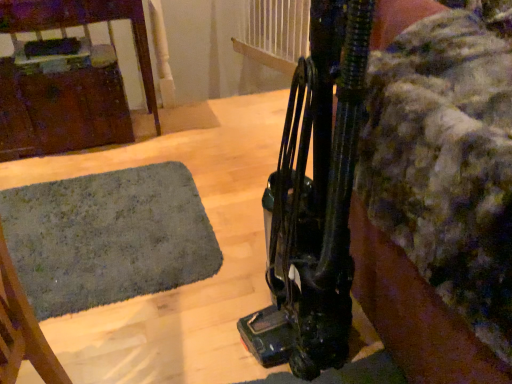
Measure the distance between point [268,275] and camera.

The depth of point [268,275] is 3.92 feet.

Locate an element on the screen. dark green carpet at lower left is located at coordinates (108, 237).

From a real-world perspective, does dark green carpet at lower left stand above black rubber vacuum cleaner at right?

Incorrect, from a real-world perspective, dark green carpet at lower left is lower than black rubber vacuum cleaner at right.

I want to click on equipment above the dark green carpet at lower left (from the image's perspective), so click(314, 201).

Is dark green carpet at lower left looking in the opposite direction of black rubber vacuum cleaner at right?

dark green carpet at lower left does not have its back to black rubber vacuum cleaner at right.

Is dark green carpet at lower left far away from black rubber vacuum cleaner at right?

No, dark green carpet at lower left is not far away from black rubber vacuum cleaner at right.

From a real-world perspective, is black rubber vacuum cleaner at right physically located above or below dark green carpet at lower left?

Clearly, from a real-world perspective, black rubber vacuum cleaner at right is above dark green carpet at lower left.

Considering the sizes of objects black rubber vacuum cleaner at right and dark green carpet at lower left in the image provided, who is wider, black rubber vacuum cleaner at right or dark green carpet at lower left?

Wider between the two is dark green carpet at lower left.

Where is `mat below the black rubber vacuum cleaner at right (from a real-world perspective)`? The image size is (512, 384). mat below the black rubber vacuum cleaner at right (from a real-world perspective) is located at coordinates click(x=108, y=237).

Between dark green carpet at lower left and brushed metal cabinet at left, which one has smaller size?

dark green carpet at lower left is smaller.

At what (x,y) coordinates should I click in order to perform the action: click on mat in front of the brushed metal cabinet at left. Please return your answer as a coordinate pair (x, y). The width and height of the screenshot is (512, 384). Looking at the image, I should click on (108, 237).

Looking at this image, from the image's perspective, which object appears higher, dark green carpet at lower left or brushed metal cabinet at left?

brushed metal cabinet at left.

Are dark green carpet at lower left and brushed metal cabinet at left located far from each other?

dark green carpet at lower left is near brushed metal cabinet at left, not far away.

Is brushed metal cabinet at left with dark green carpet at lower left?

No, brushed metal cabinet at left is not with dark green carpet at lower left.

Can you confirm if brushed metal cabinet at left is wider than dark green carpet at lower left?

Incorrect, the width of brushed metal cabinet at left does not surpass that of dark green carpet at lower left.

Is dark green carpet at lower left located within brushed metal cabinet at left?

That's incorrect, dark green carpet at lower left is not inside brushed metal cabinet at left.

Which object is further away from the camera, brushed metal cabinet at left or black rubber vacuum cleaner at right?

brushed metal cabinet at left.

The image size is (512, 384). What are the coordinates of `equipment in front of the brushed metal cabinet at left` in the screenshot? It's located at click(314, 201).

Is brushed metal cabinet at left looking in the opposite direction of black rubber vacuum cleaner at right?

No, black rubber vacuum cleaner at right is not at the back of brushed metal cabinet at left.

Which is more distant, (56, 98) or (337, 367)?

Point (56, 98)

Does black rubber vacuum cleaner at right have a smaller size compared to brushed metal cabinet at left?

Correct, black rubber vacuum cleaner at right occupies less space than brushed metal cabinet at left.

Which is more to the left, black rubber vacuum cleaner at right or brushed metal cabinet at left?

Positioned to the left is brushed metal cabinet at left.

Is the depth of black rubber vacuum cleaner at right greater than that of brushed metal cabinet at left?

No, it is in front of brushed metal cabinet at left.

From the picture: Is black rubber vacuum cleaner at right facing towards brushed metal cabinet at left?

Yes, black rubber vacuum cleaner at right is oriented towards brushed metal cabinet at left.

This screenshot has height=384, width=512. Find the location of `equipment above the dark green carpet at lower left (from a real-world perspective)`. equipment above the dark green carpet at lower left (from a real-world perspective) is located at coordinates (314, 201).

Where is `mat that is below the black rubber vacuum cleaner at right (from the image's perspective)`? The image size is (512, 384). mat that is below the black rubber vacuum cleaner at right (from the image's perspective) is located at coordinates (108, 237).

Which object lies further to the anchor point black rubber vacuum cleaner at right, brushed metal cabinet at left or dark green carpet at lower left?

brushed metal cabinet at left is further to black rubber vacuum cleaner at right.

From the image, which object appears to be farther from brushed metal cabinet at left, black rubber vacuum cleaner at right or dark green carpet at lower left?

black rubber vacuum cleaner at right is further to brushed metal cabinet at left.

From the image, which object appears to be farther from dark green carpet at lower left, black rubber vacuum cleaner at right or brushed metal cabinet at left?

The object further to dark green carpet at lower left is black rubber vacuum cleaner at right.

Considering their positions, is dark green carpet at lower left positioned closer to black rubber vacuum cleaner at right than brushed metal cabinet at left?

dark green carpet at lower left is closer to black rubber vacuum cleaner at right.

When comparing their distances from brushed metal cabinet at left, does dark green carpet at lower left or black rubber vacuum cleaner at right seem closer?

dark green carpet at lower left is positioned closer to the anchor brushed metal cabinet at left.

From the picture: Estimate the real-world distances between objects in this image. Which object is further from dark green carpet at lower left, brushed metal cabinet at left or black rubber vacuum cleaner at right?

black rubber vacuum cleaner at right.

At what (x,y) coordinates should I click in order to perform the action: click on mat positioned between black rubber vacuum cleaner at right and brushed metal cabinet at left from near to far. Please return your answer as a coordinate pair (x, y). This screenshot has height=384, width=512. Looking at the image, I should click on (108, 237).